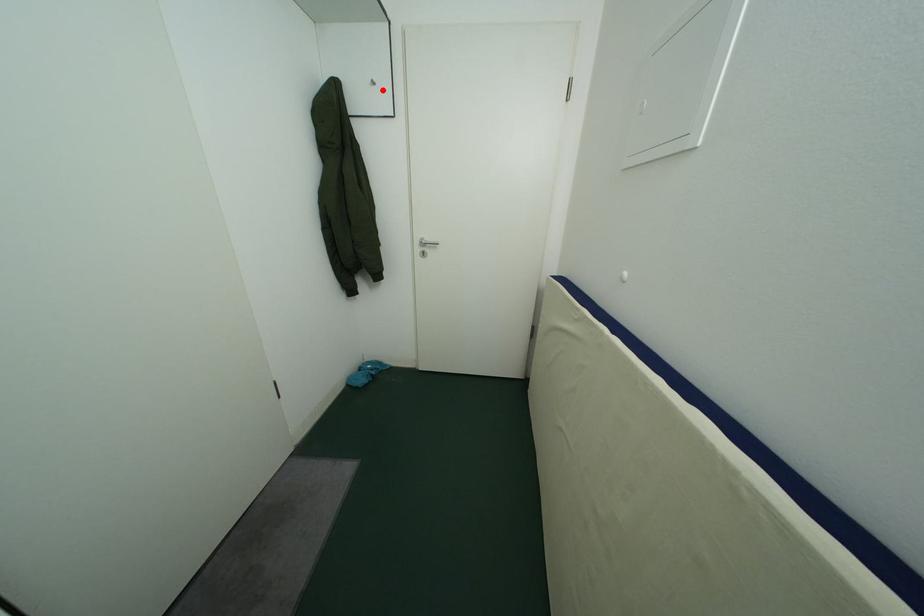
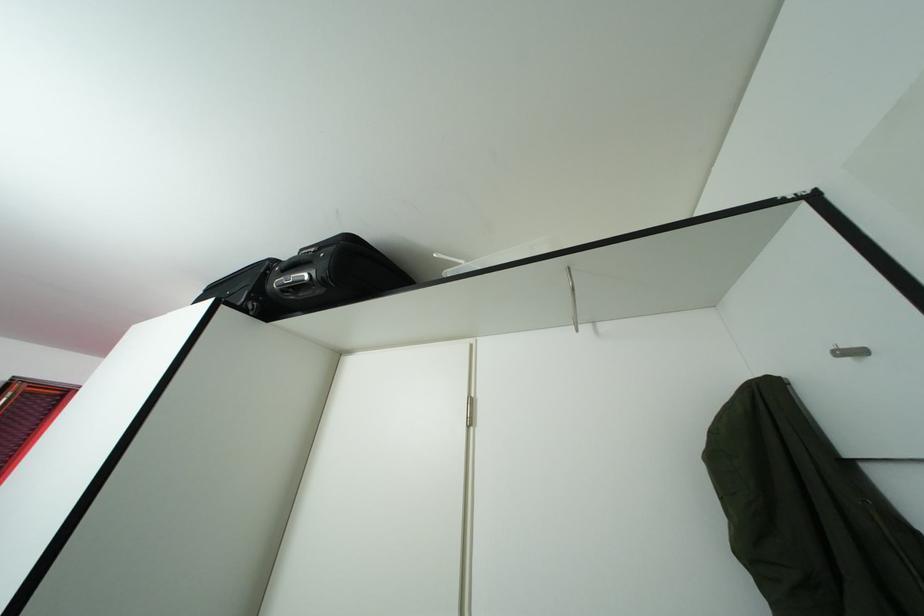
Find the pixel in the second image that matches the highlighted location in the first image.

(861, 360)